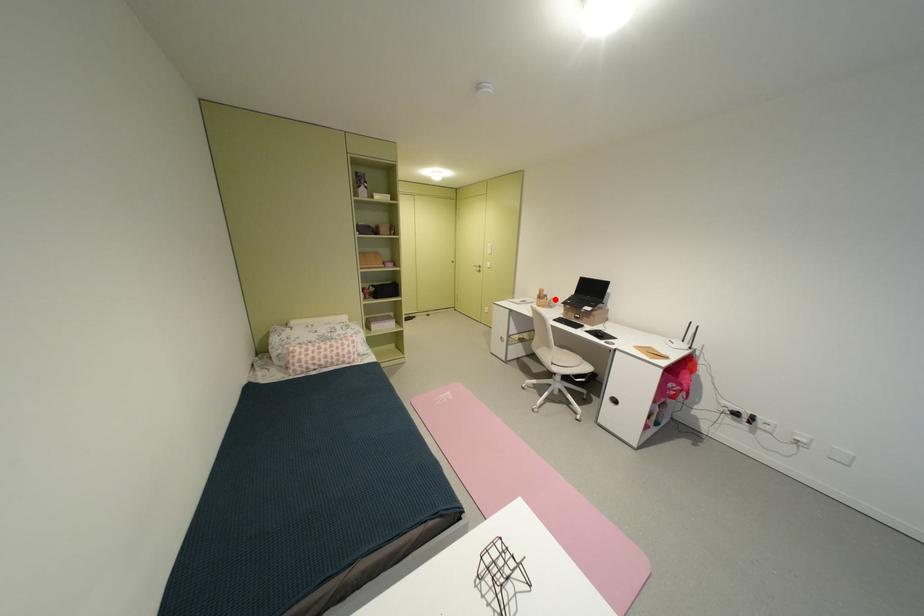
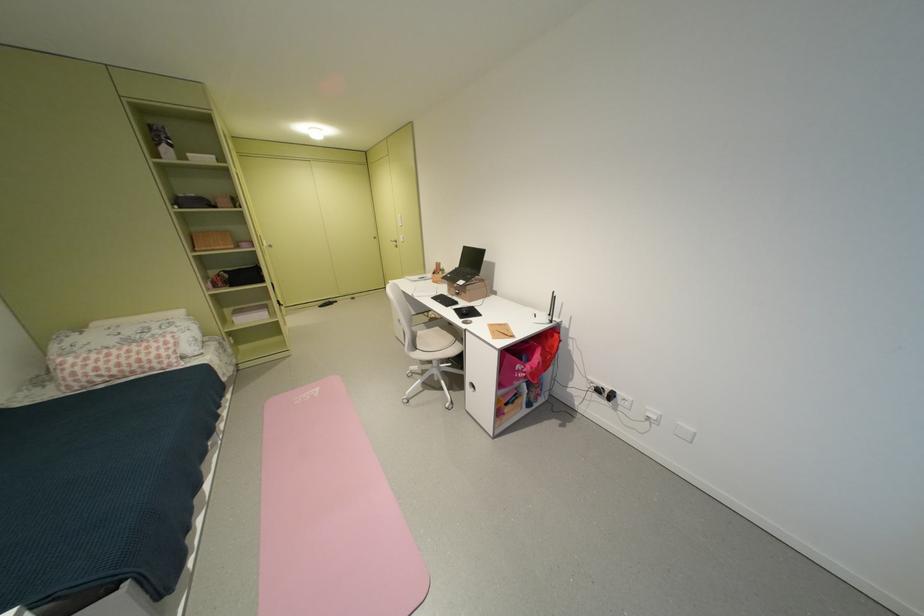
Question: I am providing you with two images of the same scene from different viewpoints. In image1, a red point is highlighted. Considering the same 3D point in image2, which of the following is correct?

Choices:
 (A) It is closer
 (B) It is farther

Answer: (B)